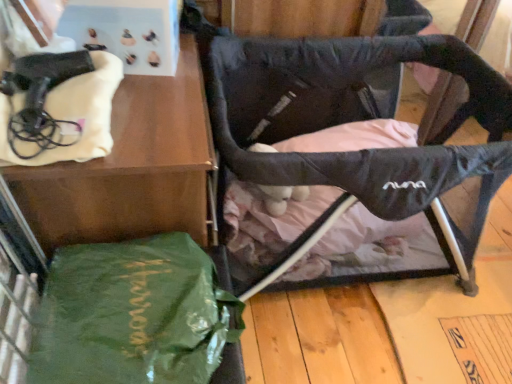
Question: Can you confirm if green fabric bag at lower left is shorter than black fabric swivel chair at center?

Choices:
 (A) no
 (B) yes

Answer: (A)

Question: From the image's perspective, is green fabric bag at lower left on black fabric swivel chair at center?

Choices:
 (A) no
 (B) yes

Answer: (A)

Question: From a real-world perspective, is green fabric bag at lower left under black fabric swivel chair at center?

Choices:
 (A) yes
 (B) no

Answer: (B)

Question: Is green fabric bag at lower left turned away from black fabric swivel chair at center?

Choices:
 (A) yes
 (B) no

Answer: (B)

Question: Is green fabric bag at lower left thinner than black fabric swivel chair at center?

Choices:
 (A) yes
 (B) no

Answer: (A)

Question: Is green fabric bag at lower left to the left or to the right of black fabric swivel chair at center in the image?

Choices:
 (A) right
 (B) left

Answer: (B)

Question: Is green fabric bag at lower left in front of or behind black fabric swivel chair at center in the image?

Choices:
 (A) front
 (B) behind

Answer: (A)

Question: Is green fabric bag at lower left wider or thinner than black fabric swivel chair at center?

Choices:
 (A) thin
 (B) wide

Answer: (A)

Question: From the image's perspective, is green fabric bag at lower left above or below black fabric swivel chair at center?

Choices:
 (A) below
 (B) above

Answer: (A)

Question: From the image's perspective, is black fabric swivel chair at center above or below green fabric bag at lower left?

Choices:
 (A) below
 (B) above

Answer: (B)

Question: Considering the positions of point (394, 276) and point (131, 165), is point (394, 276) closer or farther from the camera than point (131, 165)?

Choices:
 (A) closer
 (B) farther

Answer: (B)

Question: In terms of size, does black fabric swivel chair at center appear bigger or smaller than green fabric bag at lower left?

Choices:
 (A) big
 (B) small

Answer: (A)

Question: Relative to green fabric bag at lower left, is black fabric swivel chair at center in front or behind?

Choices:
 (A) front
 (B) behind

Answer: (B)

Question: Which is correct: green fabric bag at lower left is inside green shiny tote bag at lower left, or outside of it?

Choices:
 (A) outside
 (B) inside

Answer: (A)

Question: From a real-world perspective, relative to green shiny tote bag at lower left, is green fabric bag at lower left vertically above or below?

Choices:
 (A) below
 (B) above

Answer: (A)